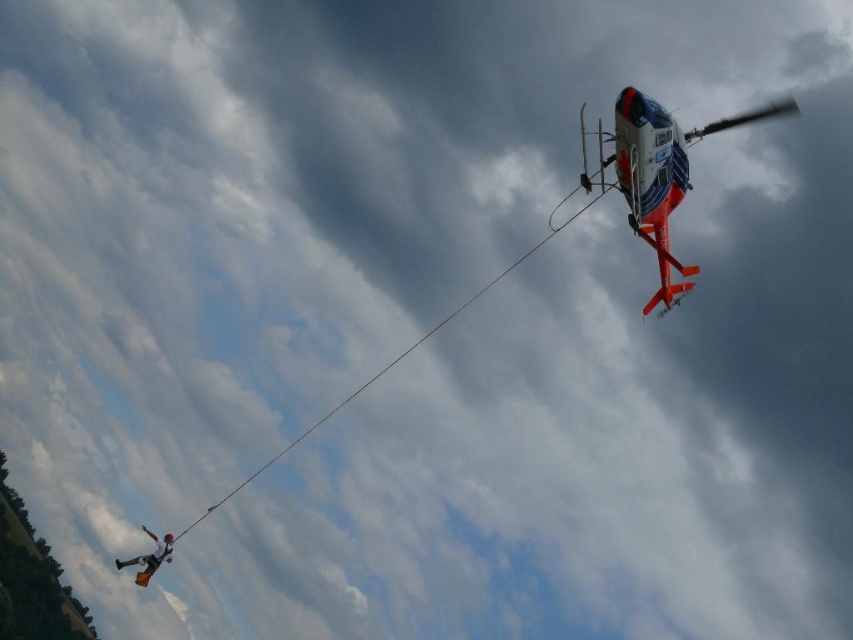
Is orange metallic helicopter at upper right in front of white fabric parachute at lower left?

That is True.

Does orange metallic helicopter at upper right have a lesser width compared to white fabric parachute at lower left?

In fact, orange metallic helicopter at upper right might be wider than white fabric parachute at lower left.

Is point (712, 129) positioned before point (170, 561)?

Yes, it is.

Identify the location of orange metallic helicopter at upper right. This screenshot has width=853, height=640. 657,172.

Who is more forward, (x=451, y=314) or (x=146, y=566)?

Positioned in front is point (x=146, y=566).

Which is behind, point (392, 365) or point (170, 557)?

The point (392, 365) is behind.

Locate an element on the screen. The height and width of the screenshot is (640, 853). smooth rope at upper right is located at coordinates (387, 365).

Can you confirm if orange metallic helicopter at upper right is shorter than smooth rope at upper right?

Indeed, orange metallic helicopter at upper right has a lesser height compared to smooth rope at upper right.

Which of these two, orange metallic helicopter at upper right or smooth rope at upper right, stands taller?

smooth rope at upper right is taller.

Where is `orange metallic helicopter at upper right`? This screenshot has width=853, height=640. orange metallic helicopter at upper right is located at coordinates (657, 172).

The width and height of the screenshot is (853, 640). In order to click on orange metallic helicopter at upper right in this screenshot , I will do `click(657, 172)`.